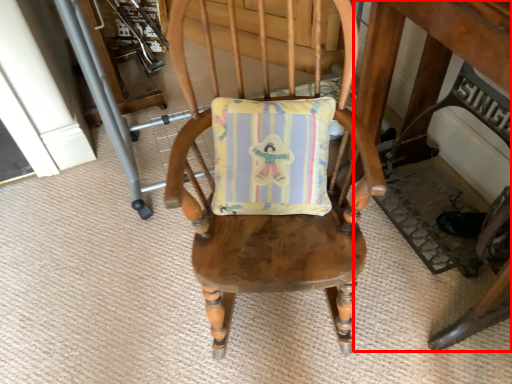
Question: From the image's perspective, what is the correct spatial positioning of table (annotated by the red box) in reference to chair?

Choices:
 (A) above
 (B) below

Answer: (A)